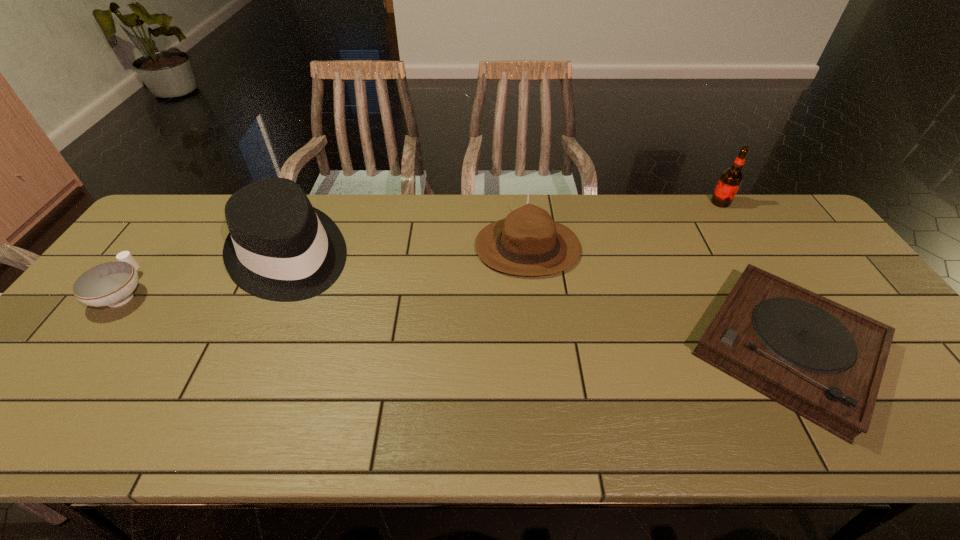
The image size is (960, 540). Find the location of `free point between the left fedora and the shorter fedora`. free point between the left fedora and the shorter fedora is located at coordinates (408, 252).

The width and height of the screenshot is (960, 540). In order to click on free space between the phonograph record and the left fedora in this screenshot , I will do `click(538, 302)`.

This screenshot has height=540, width=960. I want to click on free point between the chinaware and the taller fedora, so tap(206, 274).

I want to click on free area in between the right fedora and the taller fedora, so click(408, 252).

In order to click on object that is the fourth closest to the leftmost object in this screenshot , I will do `click(731, 179)`.

Select which object appears as the fourth closest to the leftmost object. Please provide its 2D coordinates. Your answer should be formatted as a tuple, i.e. [(x, y)], where the tuple contains the x and y coordinates of a point satisfying the conditions above.

[(731, 179)]

Where is `blank space that satisfies the following two spatial constraints: 1. on the feather side of the third tallest object; 2. on the left side of the phonograph record`? The width and height of the screenshot is (960, 540). blank space that satisfies the following two spatial constraints: 1. on the feather side of the third tallest object; 2. on the left side of the phonograph record is located at coordinates (539, 348).

This screenshot has width=960, height=540. I want to click on free location that satisfies the following two spatial constraints: 1. on the side with the handle of the root beer; 2. on the right side of the leftmost object, so click(192, 202).

Identify the location of free location that satisfies the following two spatial constraints: 1. on the feather side of the third shortest object; 2. on the back side of the phonograph record. (539, 348).